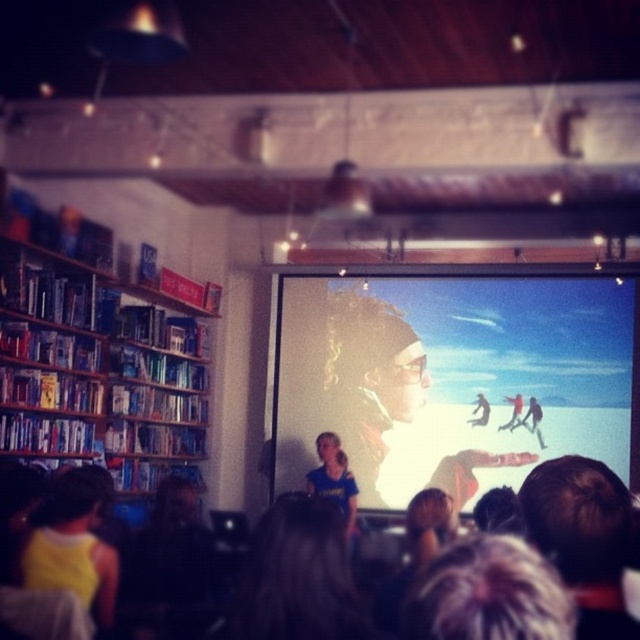
Question: Can you confirm if dark brown hair at lower center is positioned to the left of blue t-shirt at center?

Choices:
 (A) yes
 (B) no

Answer: (B)

Question: Which point is closer to the camera taking this photo?

Choices:
 (A) (522, 483)
 (B) (202, 554)
 (C) (86, 355)
 (D) (404, 340)

Answer: (A)

Question: Is dark brown hair at lower center closer to camera compared to yellow fabric at lower left?

Choices:
 (A) yes
 (B) no

Answer: (A)

Question: Estimate the real-world distances between objects in this image. Which object is farther from the dark brown hair at center?

Choices:
 (A) dark brown hair at lower center
 (B) black fabric at lower left

Answer: (B)

Question: Is dark brown hair at center above dark brown hair at lower center?

Choices:
 (A) no
 (B) yes

Answer: (A)

Question: Which object appears closest to the camera in this image?

Choices:
 (A) black fabric at lower left
 (B) yellow fabric at lower left
 (C) brown hair at center

Answer: (C)